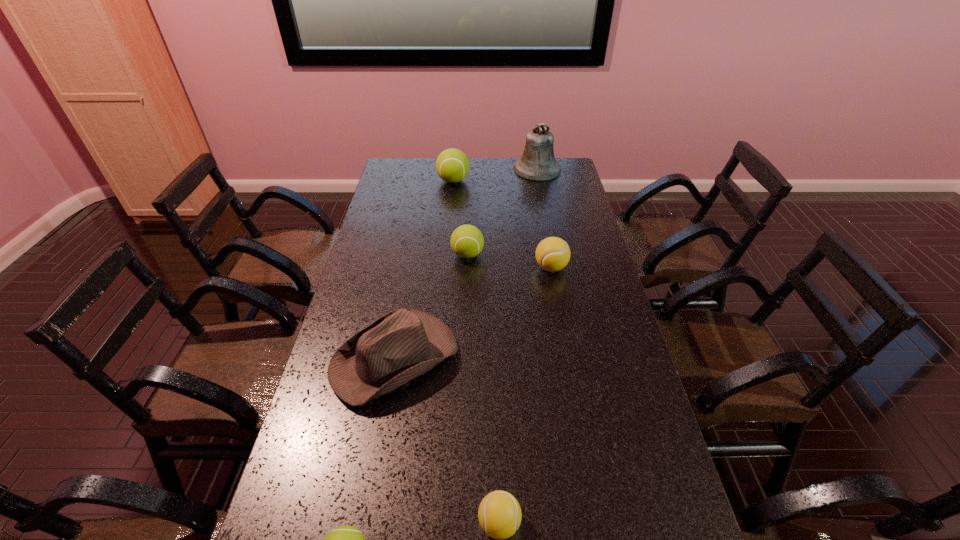
Where is `vacant area situated on the back of the right yellow tennis ball`? vacant area situated on the back of the right yellow tennis ball is located at coordinates (539, 198).

Identify the location of free space located 0.250m on the left of the second farthest green tennis ball. This screenshot has height=540, width=960. (383, 255).

The image size is (960, 540). In order to click on bell located in the far edge section of the desktop in this screenshot , I will do `click(537, 163)`.

Find the location of `tennis ball that is at the far edge`. tennis ball that is at the far edge is located at coordinates (452, 165).

Find the location of `object that is at the left edge`. object that is at the left edge is located at coordinates (403, 344).

Find the location of a particular element. bell that is at the right edge is located at coordinates (537, 163).

This screenshot has width=960, height=540. In order to click on tennis ball positioned at the right edge in this screenshot , I will do `click(552, 254)`.

The height and width of the screenshot is (540, 960). I want to click on object present at the far right corner, so click(537, 163).

This screenshot has width=960, height=540. Find the location of `free space at the far edge of the desktop`. free space at the far edge of the desktop is located at coordinates (484, 184).

Image resolution: width=960 pixels, height=540 pixels. Identify the location of vacant region at the left edge of the desktop. (391, 266).